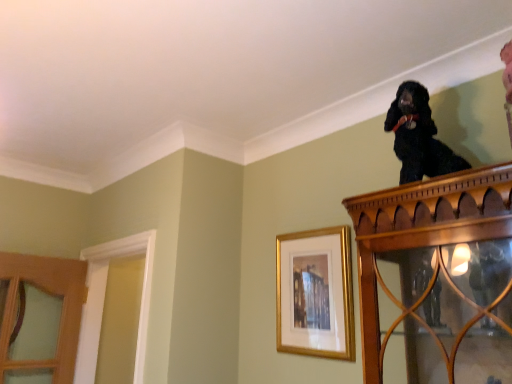
Question: In the image, is white wood door frame at left on the left side or the right side of gold framed picture at upper center?

Choices:
 (A) right
 (B) left

Answer: (B)

Question: From a real-world perspective, is white wood door frame at left above or below gold framed picture at upper center?

Choices:
 (A) below
 (B) above

Answer: (A)

Question: Based on their relative distances, which object is nearer to the black silky dog at upper right?

Choices:
 (A) gold framed picture at upper center
 (B) white wood door frame at left

Answer: (A)

Question: Considering the real-world distances, which object is closest to the gold framed picture at upper center?

Choices:
 (A) black silky dog at upper right
 (B) white wood door frame at left

Answer: (A)